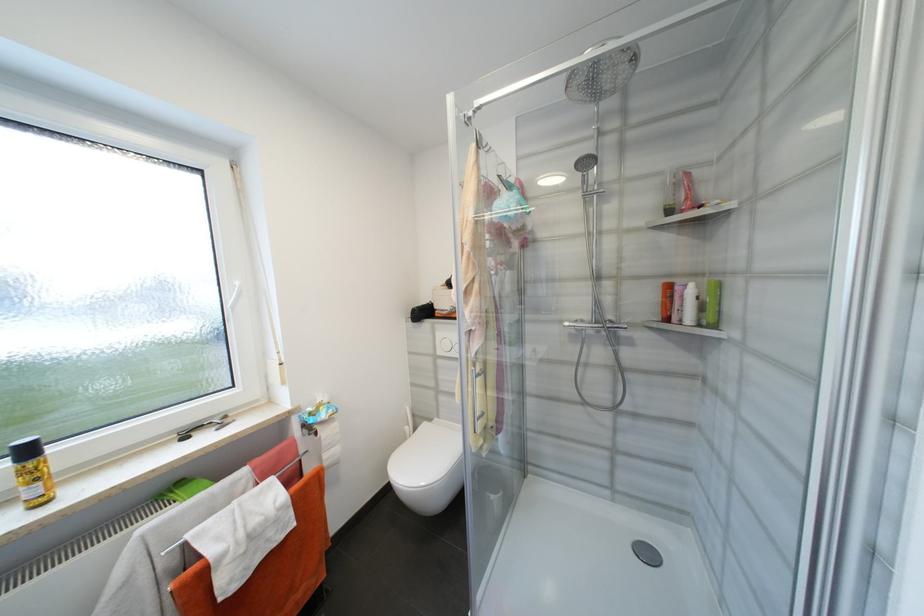
Image resolution: width=924 pixels, height=616 pixels. What are the coordinates of `white toilet lid` in the screenshot? It's located at (426, 454).